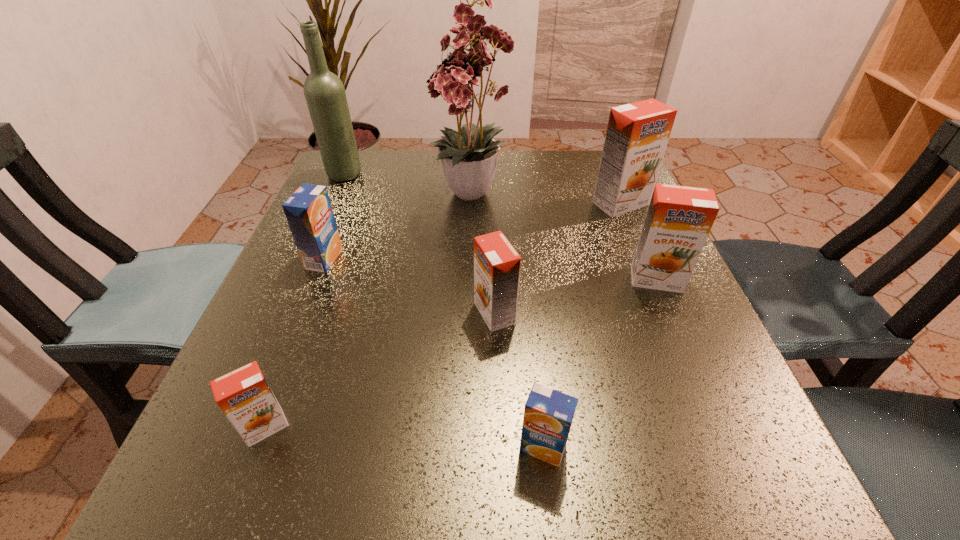
Where is `vacant region between the leftmost orange orange juice and the tallest orange juice`? The height and width of the screenshot is (540, 960). vacant region between the leftmost orange orange juice and the tallest orange juice is located at coordinates (444, 315).

You are a GUI agent. You are given a task and a screenshot of the screen. Output one action in this format:
    pyautogui.click(x=<x>, y=<y>)
    Task: Click on the vacant area that lies between the third tallest object and the second smallest orange orange juice
    The width and height of the screenshot is (960, 540).
    Given the screenshot: What is the action you would take?
    pyautogui.click(x=558, y=259)

Identify the location of free space between the farther blue orange_juice and the tallest object. (398, 227).

Identify the location of vacant area that lies between the bigger blue orange_juice and the tallest orange juice. (472, 231).

Where is `vacant region between the biggest orange orange juice and the smaller blue orange_juice`? The image size is (960, 540). vacant region between the biggest orange orange juice and the smaller blue orange_juice is located at coordinates (582, 326).

Identify which object is the fifth closest to the third nearest orange orange juice. Please provide its 2D coordinates. Your answer should be formatted as a tuple, i.e. [(x, y)], where the tuple contains the x and y coordinates of a point satisfying the conditions above.

[(308, 211)]

Where is `the sixth closest object relative to the nearer blue orange_juice`? the sixth closest object relative to the nearer blue orange_juice is located at coordinates (637, 135).

Where is `orange juice that is the fourth closest to the nearer blue orange_juice`? The height and width of the screenshot is (540, 960). orange juice that is the fourth closest to the nearer blue orange_juice is located at coordinates (308, 211).

Find the location of a particular element. orange juice that is the fourth closest one to the third orange orange juice from right to left is located at coordinates (244, 396).

Image resolution: width=960 pixels, height=540 pixels. I want to click on the closest orange orange juice to the smallest orange orange juice, so click(x=497, y=264).